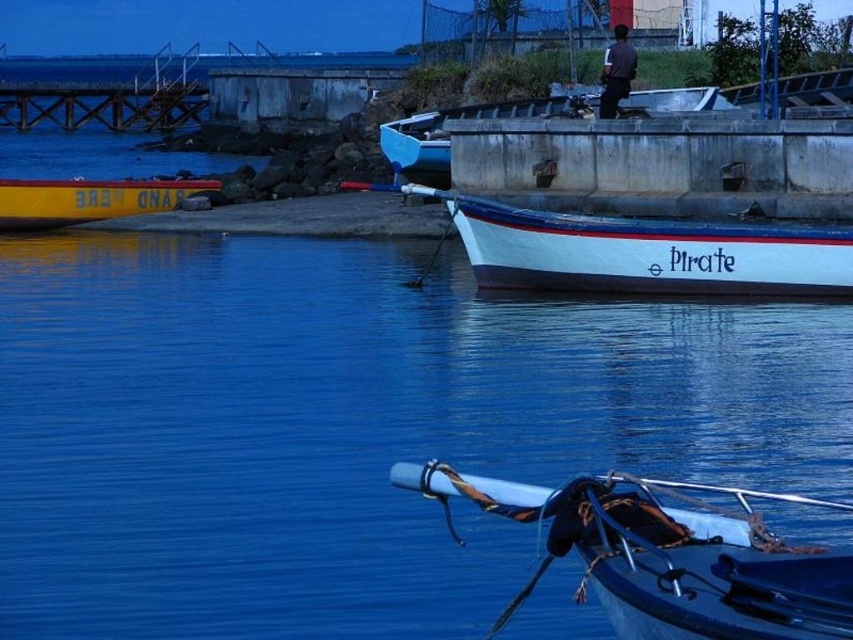
Question: Which point appears closest to the camera in this image?

Choices:
 (A) (781, 248)
 (B) (602, 428)
 (C) (608, 115)
 (D) (695, 632)

Answer: (D)

Question: Which is nearer to the metallic blue boat at lower right?

Choices:
 (A) white matte boat at upper center
 (B) dark brown shirt at upper center

Answer: (A)

Question: Can you confirm if metallic blue boat at lower right is wider than dark brown shirt at upper center?

Choices:
 (A) yes
 (B) no

Answer: (B)

Question: Among these objects, which one is nearest to the camera?

Choices:
 (A) metallic blue boat at lower right
 (B) white matte boat at upper center
 (C) dark brown shirt at upper center

Answer: (A)

Question: Is metallic blue boat at lower right positioned behind yellow matte boat at left?

Choices:
 (A) no
 (B) yes

Answer: (A)

Question: Is white matte boat at upper center positioned before white matte boat at center?

Choices:
 (A) yes
 (B) no

Answer: (A)